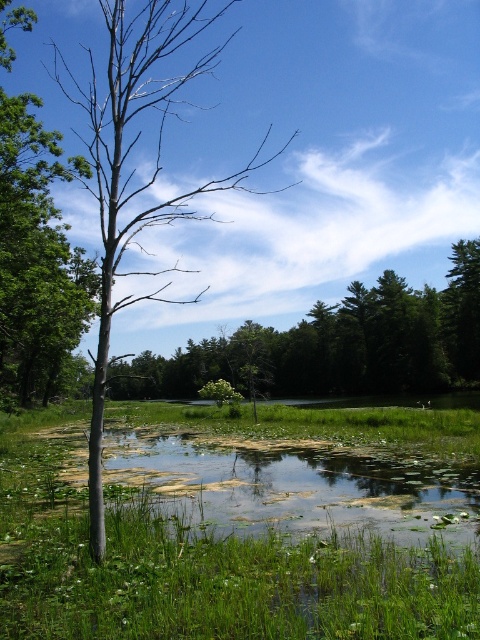
Is point (152, 376) more distant than point (122, 4)?

Yes, point (152, 376) is farther from viewer.

Which is more to the left, smooth bark tree at center or bare wood tree at left?

bare wood tree at left is more to the left.

At what (x,y) coordinates should I click in order to perform the action: click on smooth bark tree at center. Please return your answer as a coordinate pair (x, y). Looking at the image, I should click on (339, 344).

This screenshot has width=480, height=640. Find the location of `green leafy grass at center`. green leafy grass at center is located at coordinates (203, 570).

Between green leafy grass at center and bare wood tree at left, which one is positioned higher?

bare wood tree at left is higher up.

Does point (48, 586) come in front of point (146, 13)?

That is True.

At what (x,y) coordinates should I click in order to perform the action: click on green leafy grass at center. Please return your answer as a coordinate pair (x, y). Looking at the image, I should click on (203, 570).

Between green algae water at center and smooth bark tree at center, which one appears on the right side from the viewer's perspective?

Positioned to the right is green algae water at center.

Between point (134, 458) and point (322, 378), which one is positioned in front?

Point (134, 458) is in front.

Locate an element on the screen. green algae water at center is located at coordinates (298, 486).